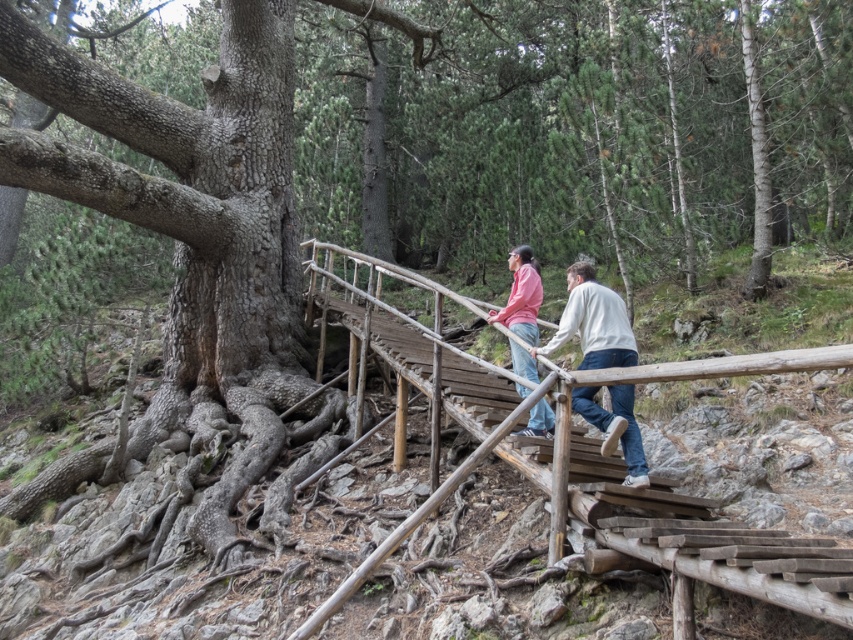
Image resolution: width=853 pixels, height=640 pixels. What do you see at coordinates (672, 529) in the screenshot?
I see `wooden rail at center` at bounding box center [672, 529].

Which of these two, wooden rail at center or matte pink shirt at center, stands shorter?

With less height is wooden rail at center.

I want to click on wooden rail at center, so click(x=672, y=529).

Image resolution: width=853 pixels, height=640 pixels. Identify the location of wooden rail at center. (672, 529).

Is matte pink sweater at center shorter than matte pink shirt at center?

No, matte pink sweater at center is not shorter than matte pink shirt at center.

Identify the location of matte pink sweater at center. (593, 323).

The image size is (853, 640). Find the location of `matte pink sweater at center`. matte pink sweater at center is located at coordinates (593, 323).

Can you confirm if wooden rail at center is positioned below matte pink sweater at center?

Yes, wooden rail at center is below matte pink sweater at center.

Does point (479, 596) come closer to viewer compared to point (619, 412)?

Yes, it is in front of point (619, 412).

Is point (399, 360) in front of point (573, 314)?

No, (399, 360) is further to viewer.

Where is `wooden rail at center`? The height and width of the screenshot is (640, 853). wooden rail at center is located at coordinates (672, 529).